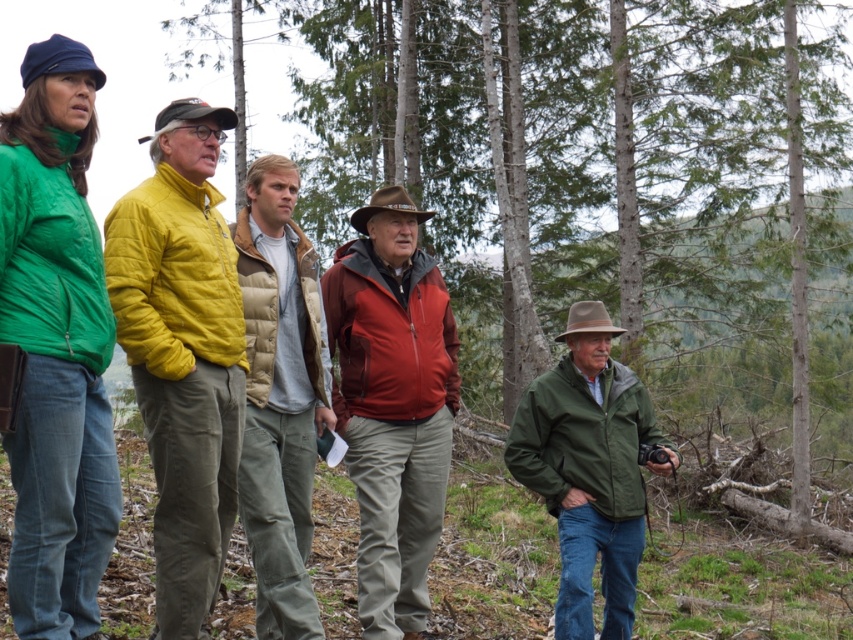
You are organizing a group photo and need to arrange the matte green jacket at left and the khaki cotton pants at center so that they are side by side. Which object should be placed on the left side to ensure proper alignment?

The matte green jacket at left should be placed on the left side because it has a lesser width compared to the khaki cotton pants at center, allowing them to align properly when placed side by side.

You are standing at the camera position and want to reach the point marked at coordinates point (149, 250) in the forest. If your walking speed is 3 feet per second, how many seconds will it take you to reach that point?

The distance between the camera and point (149, 250) is 18.57 feet. At a walking speed of 3 feet per second, it would take approximately 6.19 seconds to reach the point.

You are a photographer trying to capture a group photo of the five people in the forest scene. You notice the yellow quilted jacket at center and the matte red jacket at center. To ensure both jackets are clearly visible in the photo, which jacket should you focus on first considering their heights?

The yellow quilted jacket at center is not as tall as the matte red jacket at center, so you should focus on the matte red jacket at center first since it is taller and more likely to be the main subject.